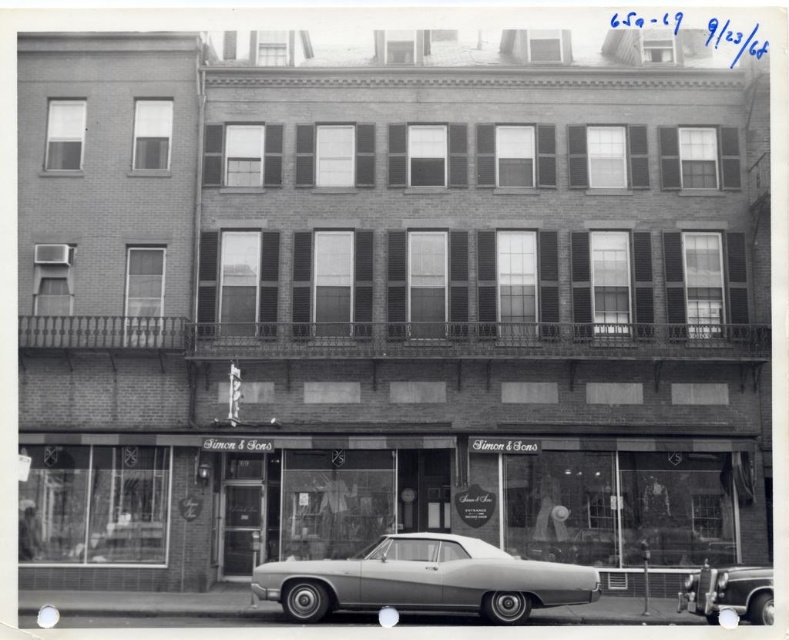
Question: Does glass storefront at center appear under shiny silver sedan at center?

Choices:
 (A) yes
 (B) no

Answer: (B)

Question: Which object is farther from the camera taking this photo?

Choices:
 (A) glass storefront at center
 (B) shiny silver sedan at center
 (C) silver metallic car at center

Answer: (A)

Question: Is glass storefront at center thinner than silver metallic car at center?

Choices:
 (A) yes
 (B) no

Answer: (B)

Question: From the image, what is the correct spatial relationship of glass storefront at center in relation to shiny silver sedan at center?

Choices:
 (A) below
 (B) above

Answer: (B)

Question: Which of the following is the closest to the observer?

Choices:
 (A) (767, 572)
 (B) (552, 604)

Answer: (A)

Question: Which of the following is the closest to the observer?

Choices:
 (A) glass storefront at center
 (B) silver metallic car at center
 (C) shiny silver sedan at center

Answer: (C)